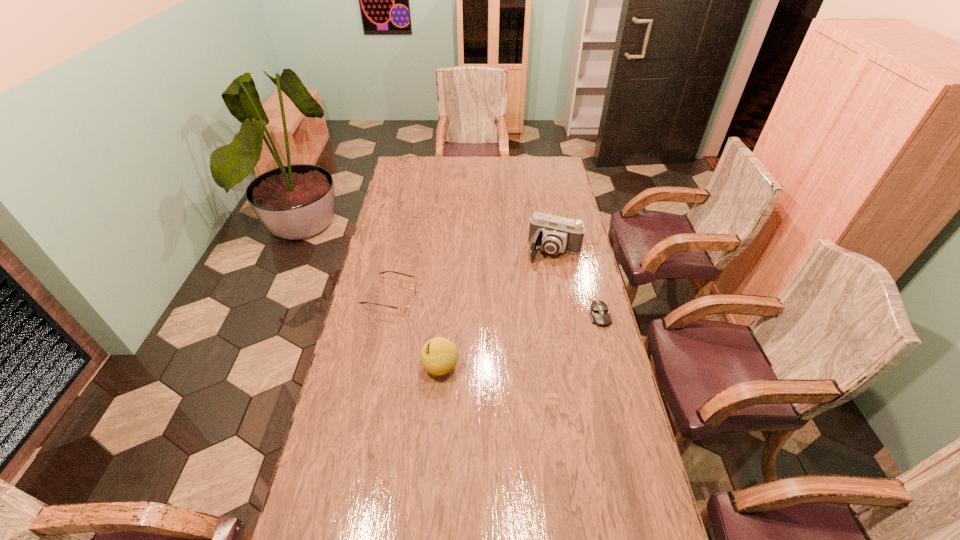
You are a GUI agent. You are given a task and a screenshot of the screen. Output one action in this format:
    pyautogui.click(x=<x>, y=<y>)
    Task: Click on the vacant region at the far edge of the desktop
    This screenshot has width=960, height=540.
    Given the screenshot: What is the action you would take?
    pyautogui.click(x=438, y=176)

Identify the location of free region at the left edge of the desktop. (344, 462).

In the image, there is a desktop. Identify the location of free space at the right edge. The height and width of the screenshot is (540, 960). (570, 191).

You are a GUI agent. You are given a task and a screenshot of the screen. Output one action in this format:
    pyautogui.click(x=<x>, y=<y>)
    Task: Click on the free spot at the near left corner of the desktop
    This screenshot has width=960, height=540.
    Given the screenshot: What is the action you would take?
    pyautogui.click(x=339, y=533)

The width and height of the screenshot is (960, 540). I want to click on free space at the near right corner, so click(x=632, y=526).

You are a GUI agent. You are given a task and a screenshot of the screen. Output one action in this format:
    pyautogui.click(x=<x>, y=<y>)
    Task: Click on the vacant point located between the third object from right to left and the tallest object
    The image size is (960, 540).
    Given the screenshot: What is the action you would take?
    pyautogui.click(x=497, y=309)

Where is `vacant space that is in between the nearest object and the tallest object`? vacant space that is in between the nearest object and the tallest object is located at coordinates (497, 309).

Locate an element on the screen. free space between the tallest object and the spectacles is located at coordinates (472, 274).

The image size is (960, 540). Identify the location of vacant area that lies between the camera and the spectacles. (472, 274).

The height and width of the screenshot is (540, 960). Identify the location of free space between the farthest object and the second shortest object. (472, 274).